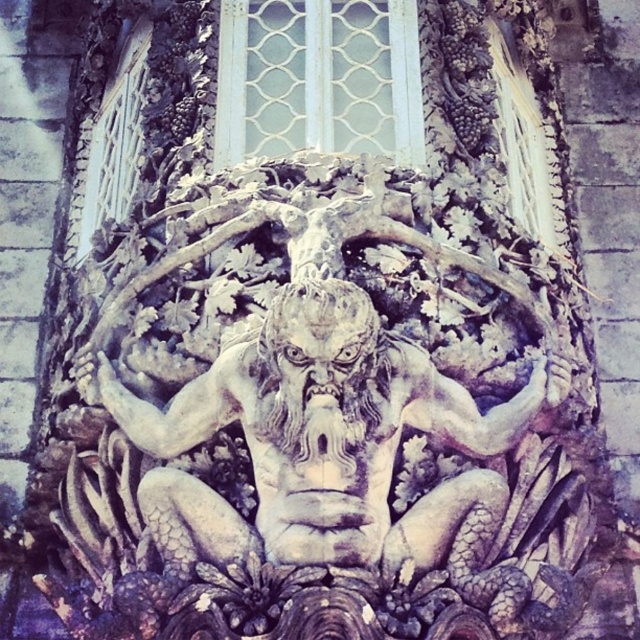
Can you confirm if stone textured gargoyle at center is positioned to the right of clear glass window at upper left?

Indeed, stone textured gargoyle at center is positioned on the right side of clear glass window at upper left.

Is stone textured gargoyle at center smaller than clear glass window at upper left?

Actually, stone textured gargoyle at center might be larger than clear glass window at upper left.

Identify the location of stone textured gargoyle at center. Image resolution: width=640 pixels, height=640 pixels. (326, 444).

Is point (132, 67) positioned after point (508, 24)?

No.

What do you see at coordinates (109, 145) in the screenshot? The height and width of the screenshot is (640, 640). I see `clear glass window at upper left` at bounding box center [109, 145].

Which is behind, point (120, 81) or point (497, 24)?

Positioned behind is point (497, 24).

Image resolution: width=640 pixels, height=640 pixels. I want to click on clear glass window at upper left, so click(x=109, y=145).

Can you confirm if stone textured gargoyle at center is positioned below clear glass window at upper center?

Yes.

Is stone textured gargoyle at center to the left of clear glass window at upper center from the viewer's perspective?

Indeed, stone textured gargoyle at center is positioned on the left side of clear glass window at upper center.

In the scene shown: Who is more distant from viewer, (x=381, y=388) or (x=490, y=17)?

Point (x=490, y=17)

Identify the location of stone textured gargoyle at center. Image resolution: width=640 pixels, height=640 pixels. (326, 444).